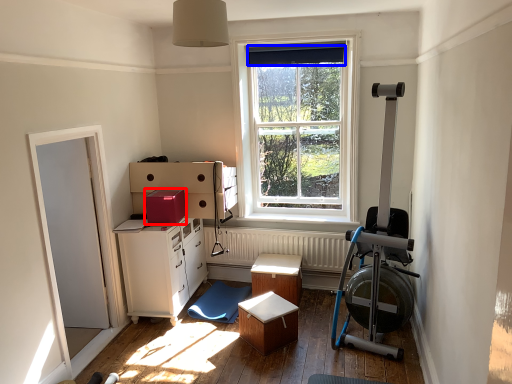
Question: Which of the following is the farthest to the observer, cardboard box (highlighted by a red box) or curtain (highlighted by a blue box)?

Choices:
 (A) cardboard box
 (B) curtain

Answer: (B)